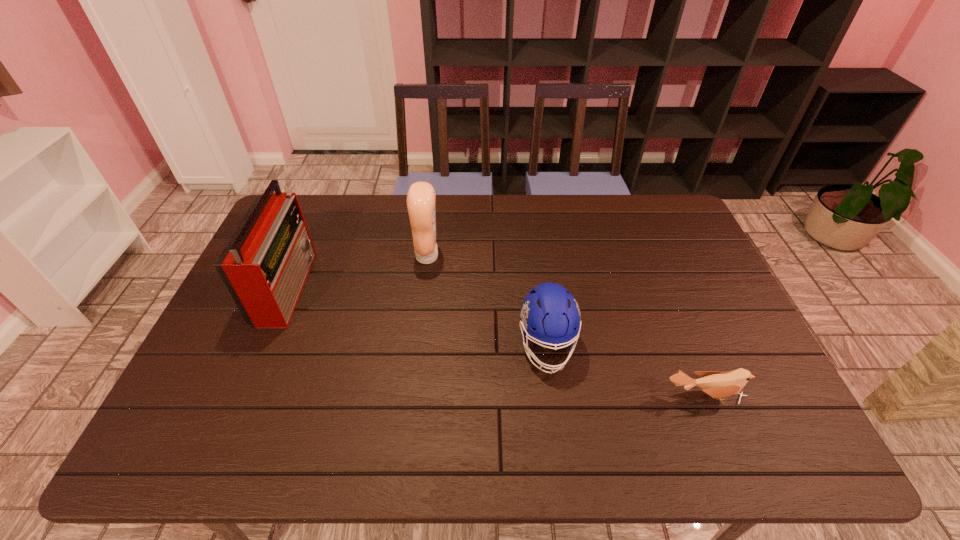
At what (x,y) coordinates should I click in order to perform the action: click on vacant region between the nearest object and the leftmost object. Please return your answer as a coordinate pair (x, y). Looking at the image, I should click on (x=495, y=341).

You are a GUI agent. You are given a task and a screenshot of the screen. Output one action in this format:
    pyautogui.click(x=<x>, y=<y>)
    Task: Click on the free area in between the third object from right to left and the radio receiver
    The height and width of the screenshot is (540, 960).
    Given the screenshot: What is the action you would take?
    pyautogui.click(x=357, y=271)

Identify the location of free space between the third tallest object and the bird. (625, 371).

Where is `vacant point located between the nearest object and the football helmet`? The image size is (960, 540). vacant point located between the nearest object and the football helmet is located at coordinates (625, 371).

Where is `vacant space that is in between the nearest object and the leftmost object`? The height and width of the screenshot is (540, 960). vacant space that is in between the nearest object and the leftmost object is located at coordinates (495, 341).

Identify the location of free space between the third tallest object and the bird. The height and width of the screenshot is (540, 960). (625, 371).

Identify the location of empty space that is in between the football helmet and the radio receiver. (417, 316).

Find the location of a particular element. The width and height of the screenshot is (960, 540). object that is the second closest to the football helmet is located at coordinates (421, 199).

I want to click on object identified as the third closest to the rightmost object, so click(265, 264).